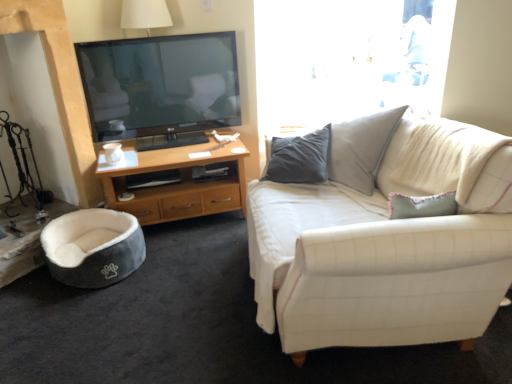
At what (x,y) coordinates should I click in order to perform the action: click on free space that is in between woodendesk at left and white fabric couch at right. Please return your answer as a coordinate pair (x, y). Looking at the image, I should click on (206, 294).